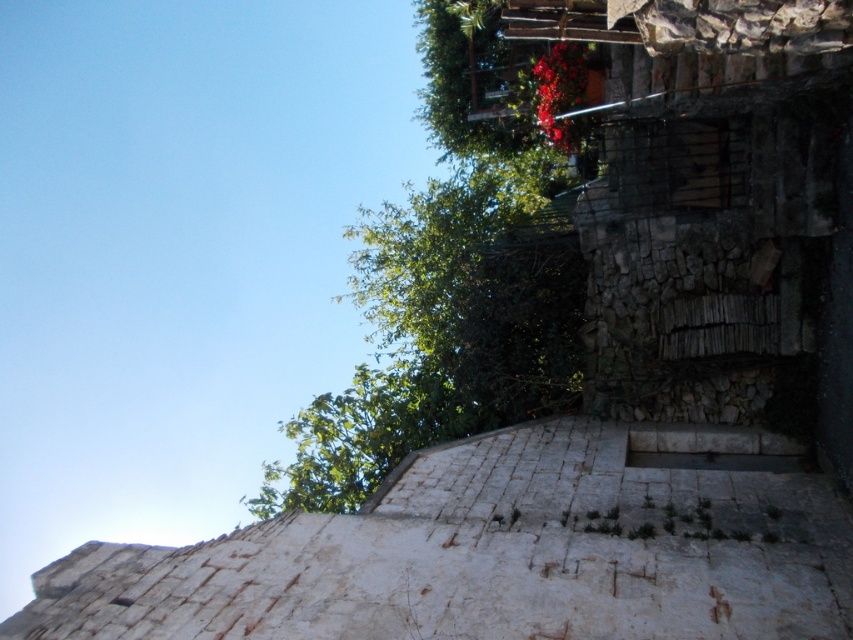
You are standing in front of a stone wall with two points marked on it. The first point is at coordinates point (x=368, y=221), and the second point is at point (x=549, y=100). Which of these two points is closer to your eyes?

Point (x=549, y=100) is closer to your eyes because it is less further to the camera than point (x=368, y=221).

You are standing in front of a stone wall with a clear blue sky above. You notice a green leafy tree at upper center and bright red petals at upper center. Which object is located lower in the scene?

The green leafy tree at upper center is positioned under bright red petals at upper center, so the tree is lower than the petals.